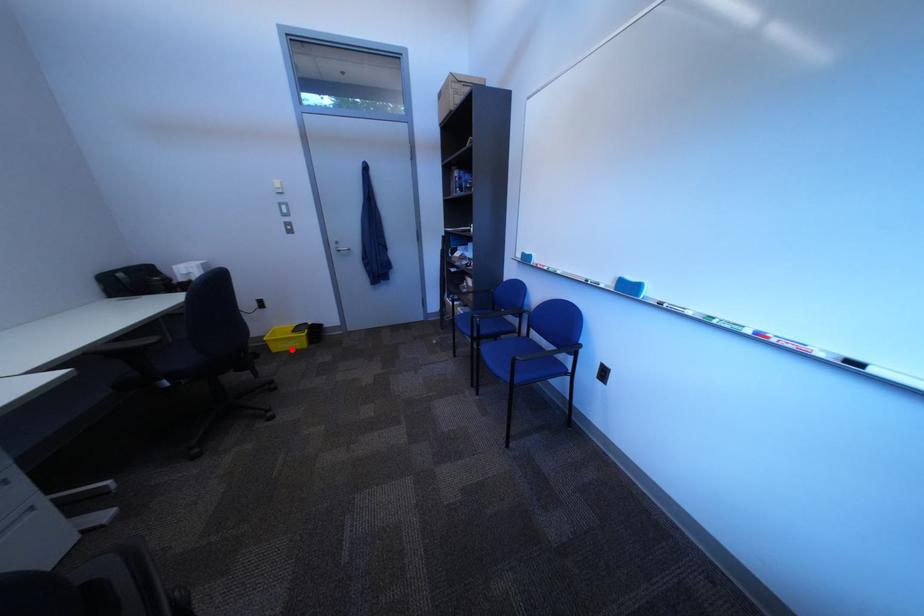
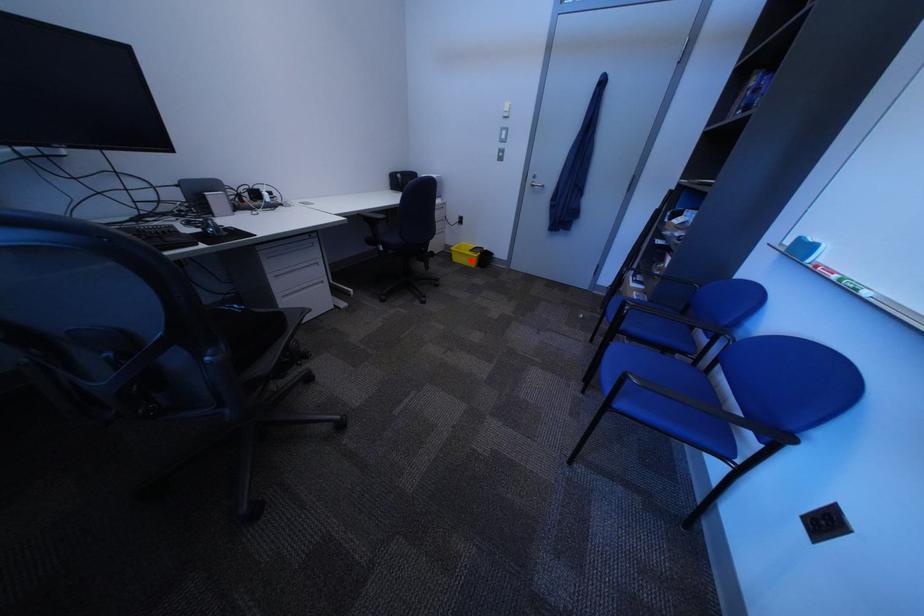
I am providing you with two images of the same scene from different viewpoints. A red point is marked on the first image and another point is marked on the second image. Do the highlighted points in image1 and image2 indicate the same real-world spot?

Yes